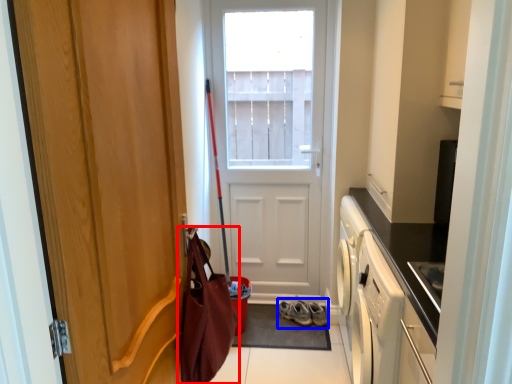
Question: Which object appears farthest to the camera in this image, messenger bag (highlighted by a red box) or footwear (highlighted by a blue box)?

Choices:
 (A) messenger bag
 (B) footwear

Answer: (B)